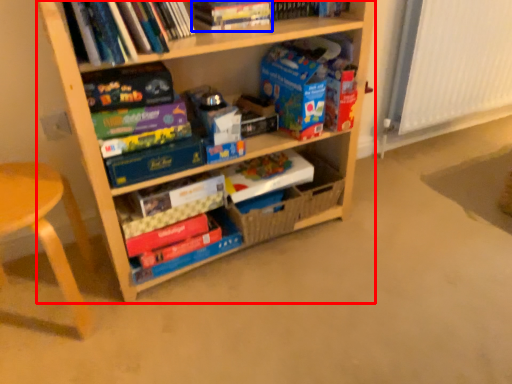
Question: Among these objects, which one is farthest to the camera, shelf (highlighted by a red box) or book (highlighted by a blue box)?

Choices:
 (A) shelf
 (B) book

Answer: (B)